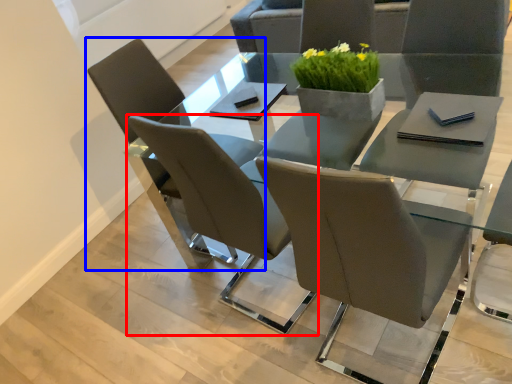
Question: Which object is closer to the camera taking this photo, chair (highlighted by a red box) or chair (highlighted by a blue box)?

Choices:
 (A) chair
 (B) chair

Answer: (A)